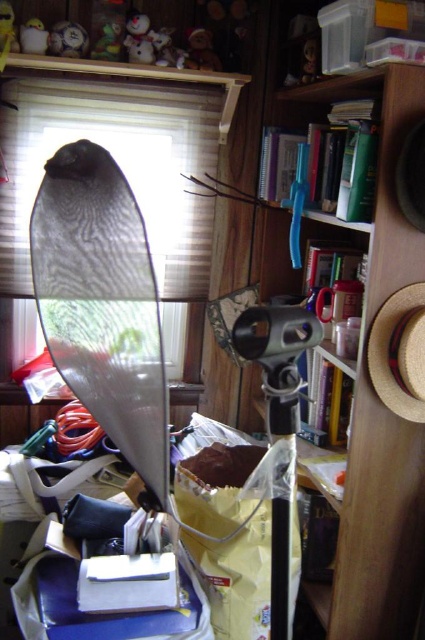
Question: Which of these objects is positioned closest to the white plush toy at upper left?

Choices:
 (A) wooden snowman at upper center
 (B) wooden bookshelf at upper center

Answer: (A)

Question: Which point is farther from the camera taking this photo?

Choices:
 (A) (42, 40)
 (B) (99, 51)

Answer: (B)

Question: Which point is closer to the camera taking this photo?

Choices:
 (A) [x=147, y=304]
 (B) [x=87, y=36]
 (C) [x=314, y=72]

Answer: (A)

Question: Is white glossy snowman at upper left bigger than wooden snowman at upper center?

Choices:
 (A) yes
 (B) no

Answer: (B)

Question: Is the position of metallic textured reflector at left less distant than that of matte plastic snowman at upper center?

Choices:
 (A) yes
 (B) no

Answer: (A)

Question: Considering the relative positions of matte plastic snowman at upper center and white glossy snowman at upper left in the image provided, where is matte plastic snowman at upper center located with respect to white glossy snowman at upper left?

Choices:
 (A) right
 (B) left

Answer: (A)